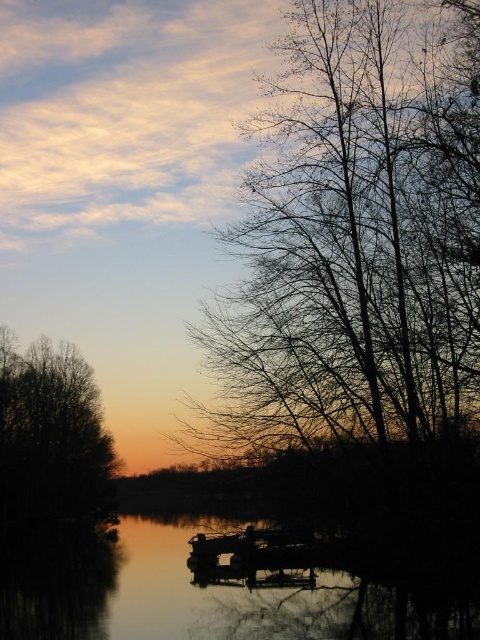
You are standing in the scene and want to touch the closest tree. Which one should you approach, the silhouette bare branches at right or the brown leafless tree at left?

You should approach the silhouette bare branches at right because it is closer to the viewer than the brown leafless tree at left.

You are an artist trying to sketch the scene. You need to decide which object to draw first based on their sizes. Which one should you start with, the silky smooth water at center or the brown leafless tree at left?

You should start with the silky smooth water at center because its width is greater than the brown leafless tree at left, making it a larger feature in the scene.